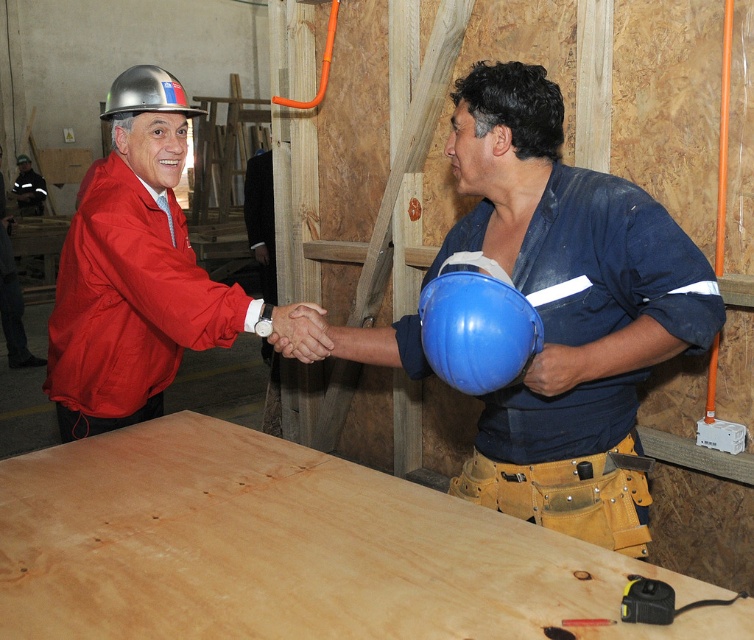
You are an inspector in this workshop and need to check the hard hats. Which hard hat is closer to you, the matte silver hard hat at left or the metallic hard hat at upper left?

The matte silver hard hat at left is closer to you since it is in front of the metallic hard hat at upper left.

You are an inspector checking the construction site. You notice the natural wood plywood at center and the metallic hard hat at upper left. Which object is taller?

The natural wood plywood at center is taller than the metallic hard hat at upper left according to the description.

You are standing at the origin point of the coordinate system in the workshop scene. There is a point at coordinate (x=290, y=548). What object is located at that coordinate?

The point at coordinate (x=290, y=548) corresponds to natural wood plywood at center.